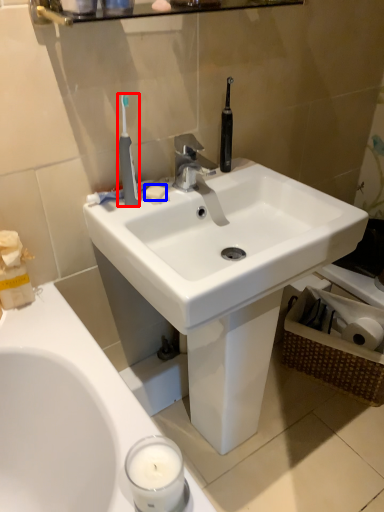
Question: Which object is closer to the camera taking this photo, toothbrush (highlighted by a red box) or soap (highlighted by a blue box)?

Choices:
 (A) toothbrush
 (B) soap

Answer: (A)